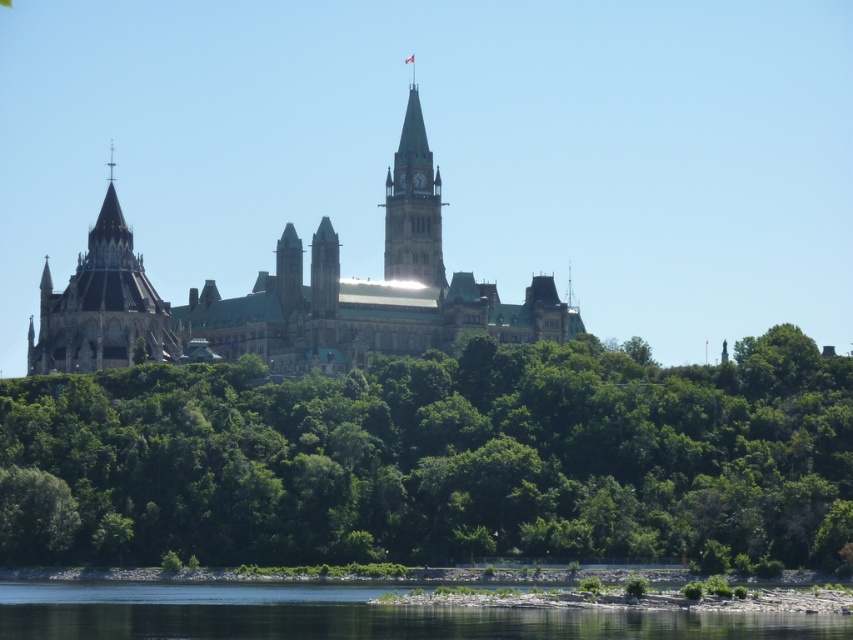
You are standing on the hill looking at the green slate roof at center and the transparent water at lower center. Which object is closer to you?

The green slate roof at center is closer to you because it is further to the viewer than the transparent water at lower center.

Looking at this image, you are standing on the hill overlooking the green slate roof at center and dark brown stone tower at left. Which structure is closer to the left side of your view?

The dark brown stone tower at left is closer to the left side of your view because the green slate roof at center is positioned on the right side of it.

You are standing on the hill overlooking the green slate roof at center and the transparent water at lower center. Which object is located to the right side of the other?

The transparent water at lower center is located to the right side of the green slate roof at center.